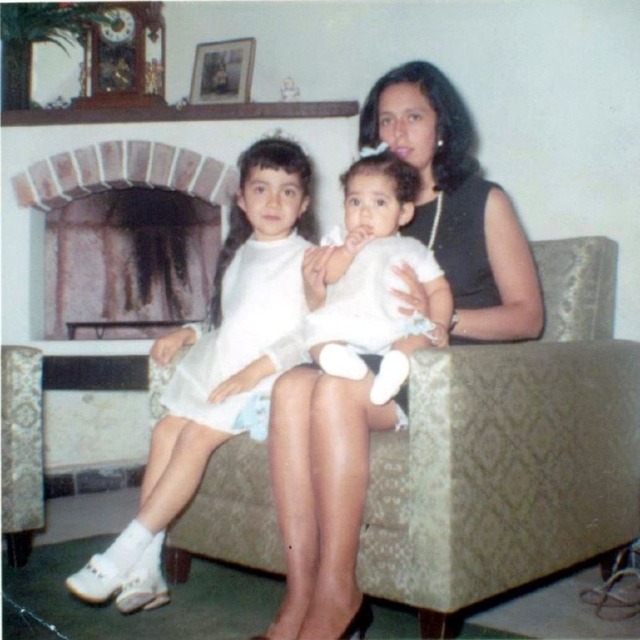
You are a photographer setting up for a family photo. You need to ensure that the white matte dress at center and the white soft baby at center are both visible in the frame. Given that the dress is taller, where should you position your camera to capture both effectively?

Since the white matte dress at center is taller than the white soft baby at center, positioning the camera at a lower angle will ensure both the dress and the baby are fully visible in the frame.

You are a photographer setting up a camera at eye level with the white soft baby at center. You want to ensure both the baby and the brick fireplace at upper left are in focus. Considering their heights, which object will require you to adjust the camera focus more?

The white soft baby at center has a greater height compared to the brick fireplace at upper left. Since the baby is taller, the camera focus might need more adjustment to capture both subjects clearly, especially if they are at different distances from the camera.

You are a photographer setting up for a family portrait. You want to position the green textured couch at center so that it faces the brick fireplace at upper left. Based on their current positions, is the couch already positioned to face the fireplace?

The green textured couch at center is located below the brick fireplace at upper left, so yes, the couch is already facing the fireplace since it is positioned directly beneath it.